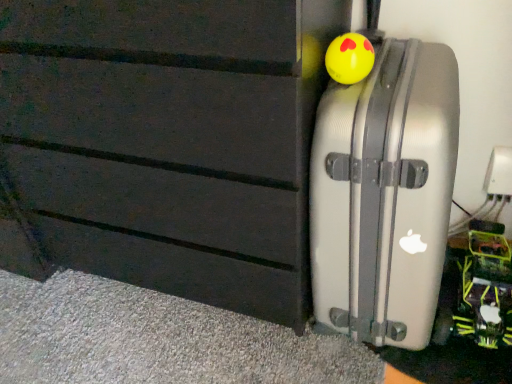
Question: From the image's perspective, is yellow rubber ball at upper right, acting as the second toy starting from the bottom, above or below silver metallic suitcase at right?

Choices:
 (A) below
 (B) above

Answer: (B)

Question: Considering the positions of point (351, 33) and point (384, 337), is point (351, 33) closer or farther from the camera than point (384, 337)?

Choices:
 (A) farther
 (B) closer

Answer: (B)

Question: Estimate the real-world distances between objects in this image. Which object is farther from the silver metallic suitcase at right?

Choices:
 (A) yellow rubber ball at upper right, which appears as the 1th toy when viewed from the front
 (B) neon green plastic toy at lower right, arranged as the 1th toy when ordered from the bottom

Answer: (B)

Question: Which object is the closest to the neon green plastic toy at lower right, arranged as the 1th toy when ordered from the bottom?

Choices:
 (A) silver metallic suitcase at right
 (B) yellow rubber ball at upper right, which appears as the 1th toy when viewed from the front

Answer: (A)